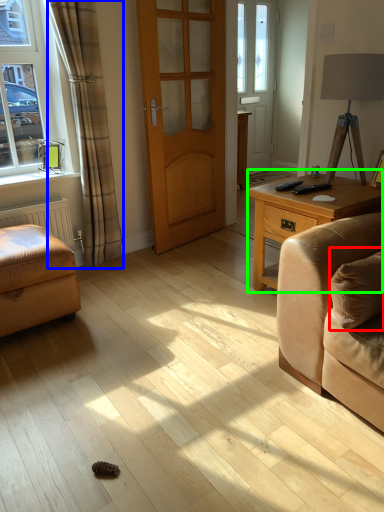
Question: Estimate the real-world distances between objects in this image. Which object is farther from pillow (highlighted by a red box), curtain (highlighted by a blue box) or table (highlighted by a green box)?

Choices:
 (A) curtain
 (B) table

Answer: (A)